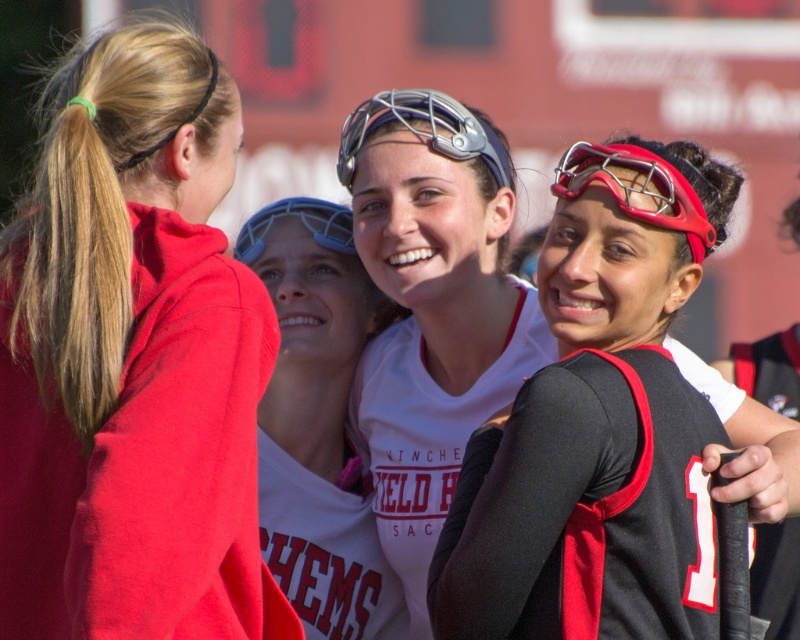
Does matte red hoodie at left have a greater width compared to white matte jersey at center?

Yes.

Does matte red hoodie at left appear on the right side of white matte jersey at center?

In fact, matte red hoodie at left is to the left of white matte jersey at center.

Who is more distant from viewer, (x=64, y=500) or (x=308, y=243)?

The point (x=308, y=243) is more distant.

Identify the location of matte red hoodie at left. (132, 360).

The image size is (800, 640). Describe the element at coordinates (436, 227) in the screenshot. I see `matte white jersey at center` at that location.

How much distance is there between matte white jersey at center and white matte jersey at center?

matte white jersey at center and white matte jersey at center are 4.43 meters apart from each other.

Locate an element on the screen. This screenshot has width=800, height=640. matte white jersey at center is located at coordinates (436, 227).

Identify the location of matte white jersey at center. The width and height of the screenshot is (800, 640). (436, 227).

Can you confirm if matte white jersey at center is shorter than red matte metal goggles at upper right?

No.

Who is shorter, matte white jersey at center or red matte metal goggles at upper right?

red matte metal goggles at upper right is shorter.

Is point (400, 262) closer to camera compared to point (608, 160)?

No, (400, 262) is further to viewer.

At what (x,y) coordinates should I click in order to perform the action: click on matte white jersey at center. Please return your answer as a coordinate pair (x, y). The height and width of the screenshot is (640, 800). Looking at the image, I should click on (436, 227).